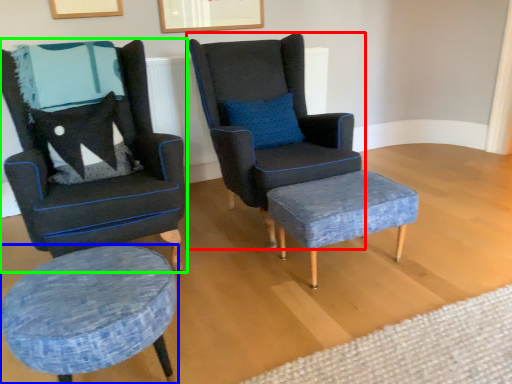
Question: Which object is the farthest from chair (highlighted by a red box)? Choose among these: stool (highlighted by a blue box) or chair (highlighted by a green box).

Choices:
 (A) stool
 (B) chair

Answer: (A)